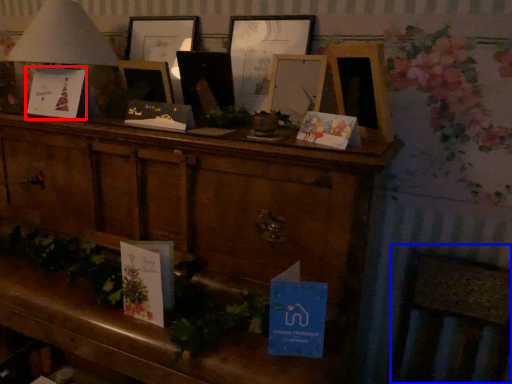
Question: Which point is further to the camera, christmas card (highlighted by a red box) or rocking chair (highlighted by a blue box)?

Choices:
 (A) christmas card
 (B) rocking chair

Answer: (A)